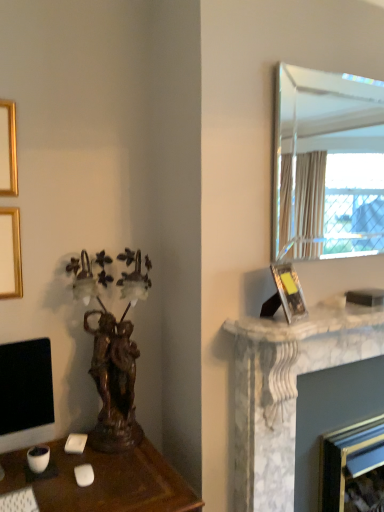
Question: Is point (352, 318) closer or farther from the camera than point (23, 501)?

Choices:
 (A) farther
 (B) closer

Answer: (A)

Question: Do you think white marble fireplace at right is within white plastic keyboard at lower left, or outside of it?

Choices:
 (A) inside
 (B) outside

Answer: (B)

Question: Based on their relative distances, which object is farther from the matte black picture frame at right?

Choices:
 (A) white marble fireplace at right, the first fireplace when ordered from top to bottom
 (B) clear glass mirror at upper right
 (C) white plastic keyboard at lower left
 (D) white marble fireplace at right, marked as the 2th fireplace in a top-to-bottom arrangement
 (E) white marble fireplace at right

Answer: (B)

Question: Estimate the real-world distances between objects in this image. Which object is closer to the white plastic keyboard at lower left?

Choices:
 (A) matte black monitor at lower left
 (B) white marble fireplace at right
 (C) white marble fireplace at right, the first fireplace when ordered from top to bottom
 (D) matte black picture frame at right
 (E) white marble fireplace at right, marked as the 2th fireplace in a top-to-bottom arrangement

Answer: (A)